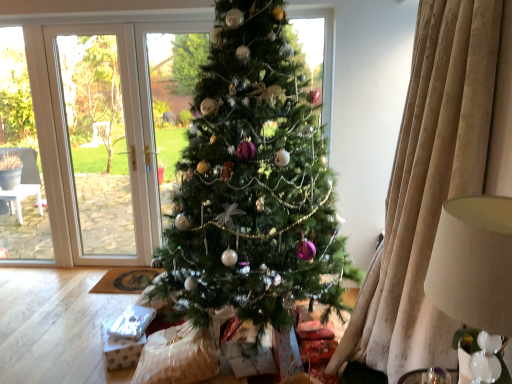
You are a GUI agent. You are given a task and a screenshot of the screen. Output one action in this format:
    pyautogui.click(x=<x>, y=<y>)
    Task: Click on the beige fabric lampshade at right
    
    Given the screenshot: What is the action you would take?
    pyautogui.click(x=474, y=263)

The image size is (512, 384). What do you see at coordinates (474, 263) in the screenshot?
I see `beige fabric lampshade at right` at bounding box center [474, 263].

The image size is (512, 384). I want to click on green matte christmas tree at center, so click(x=253, y=184).

Measure the distance between point (325, 188) and camera.

The depth of point (325, 188) is 2.44 meters.

This screenshot has width=512, height=384. What do you see at coordinates (253, 184) in the screenshot?
I see `green matte christmas tree at center` at bounding box center [253, 184].

In order to face green matte christmas tree at center, should I rotate leftwards or rightwards?

You should rotate left by 2.789 degrees.

What is the approximate height of green matte christmas tree at center?

green matte christmas tree at center is 6.88 feet tall.

Image resolution: width=512 pixels, height=384 pixels. What are the coordinates of `beige fabric lampshade at right` in the screenshot? It's located at (474, 263).

Between green matte christmas tree at center and beige fabric lampshade at right, which one appears on the left side from the viewer's perspective?

green matte christmas tree at center is more to the left.

Relative to beige fabric lampshade at right, is green matte christmas tree at center in front or behind?

In the image, green matte christmas tree at center appears behind beige fabric lampshade at right.

Is point (251, 121) positioned after point (486, 312)?

Yes, point (251, 121) is behind point (486, 312).

From the image's perspective, which is above, green matte christmas tree at center or beige fabric lampshade at right?

green matte christmas tree at center is shown above in the image.

From a real-world perspective, is green matte christmas tree at center positioned under beige fabric lampshade at right based on gravity?

No.

Is green matte christmas tree at center wider than beige fabric lampshade at right?

Indeed, green matte christmas tree at center has a greater width compared to beige fabric lampshade at right.

In terms of height, does green matte christmas tree at center look taller or shorter compared to beige fabric lampshade at right?

In the image, green matte christmas tree at center appears to be taller than beige fabric lampshade at right.

Looking at this image, does green matte christmas tree at center have a larger size compared to beige fabric lampshade at right?

Indeed, green matte christmas tree at center has a larger size compared to beige fabric lampshade at right.

Is green matte christmas tree at center spatially inside beige fabric lampshade at right, or outside of it?

green matte christmas tree at center is not enclosed by beige fabric lampshade at right.

Is there a large distance between green matte christmas tree at center and beige fabric lampshade at right?

Yes, green matte christmas tree at center and beige fabric lampshade at right are located far from each other.

Could you tell me if green matte christmas tree at center is turned towards beige fabric lampshade at right?

No, green matte christmas tree at center is not turned towards beige fabric lampshade at right.

From the picture: Can you tell me how much green matte christmas tree at center and beige fabric lampshade at right differ in facing direction?

There is a 91.5-degree angle between the facing directions of green matte christmas tree at center and beige fabric lampshade at right.

At what (x,y) coordinates should I click in order to perform the action: click on lamp below the green matte christmas tree at center (from the image's perspective). Please return your answer as a coordinate pair (x, y). The image size is (512, 384). Looking at the image, I should click on (474, 263).

From the picture: Does beige fabric lampshade at right appear on the right side of green matte christmas tree at center?

Correct, you'll find beige fabric lampshade at right to the right of green matte christmas tree at center.

Which object is closer to the camera, beige fabric lampshade at right or green matte christmas tree at center?

Positioned in front is beige fabric lampshade at right.

Which point is more distant from viewer, (510, 286) or (242, 158)?

The point (242, 158) is more distant.

From the image's perspective, is beige fabric lampshade at right above or below green matte christmas tree at center?

From the image's perspective, beige fabric lampshade at right appears below green matte christmas tree at center.

From a real-world perspective, relative to green matte christmas tree at center, is beige fabric lampshade at right vertically above or below?

In terms of real-world spatial position, beige fabric lampshade at right is below green matte christmas tree at center.

Which of these two, beige fabric lampshade at right or green matte christmas tree at center, is thinner?

beige fabric lampshade at right.

Which of these two, beige fabric lampshade at right or green matte christmas tree at center, stands shorter?

With less height is beige fabric lampshade at right.

Looking at the image, does beige fabric lampshade at right seem bigger or smaller compared to green matte christmas tree at center?

beige fabric lampshade at right is smaller than green matte christmas tree at center.

Is green matte christmas tree at center completely or partially inside beige fabric lampshade at right?

Actually, green matte christmas tree at center is outside beige fabric lampshade at right.

Are beige fabric lampshade at right and green matte christmas tree at center making contact?

No, beige fabric lampshade at right is not beside green matte christmas tree at center.

Is beige fabric lampshade at right aimed at green matte christmas tree at center?

No, beige fabric lampshade at right is not aimed at green matte christmas tree at center.

In the scene shown: Can you tell me how much beige fabric lampshade at right and green matte christmas tree at center differ in facing direction?

91.5 degrees.

Measure the distance from beige fabric lampshade at right to green matte christmas tree at center.

3.99 feet.

You are a GUI agent. You are given a task and a screenshot of the screen. Output one action in this format:
    pyautogui.click(x=<x>, y=<y>)
    Task: Click on the christmas tree to the left of beige fabric lampshade at right
    This screenshot has width=512, height=384.
    Given the screenshot: What is the action you would take?
    pyautogui.click(x=253, y=184)

At what (x,y) coordinates should I click in order to perform the action: click on lamp below the green matte christmas tree at center (from a real-world perspective). Please return your answer as a coordinate pair (x, y). Image resolution: width=512 pixels, height=384 pixels. Looking at the image, I should click on (474, 263).

I want to click on christmas tree lying behind the beige fabric lampshade at right, so click(x=253, y=184).